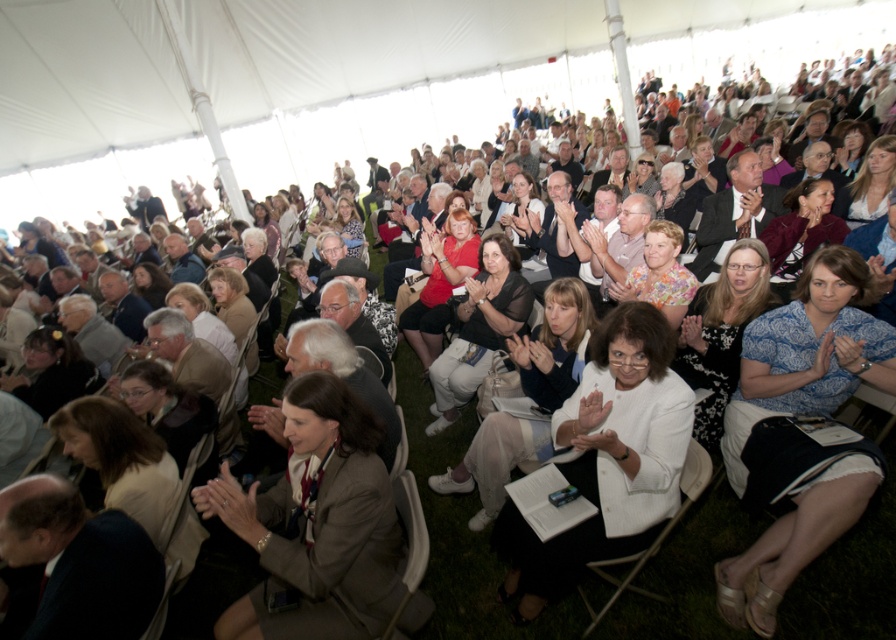
Question: Is floral fabric dress at center to the left of light brown leather jacket at center from the viewer's perspective?

Choices:
 (A) yes
 (B) no

Answer: (B)

Question: Does matte red shirt at center have a smaller size compared to floral fabric dress at center?

Choices:
 (A) no
 (B) yes

Answer: (A)

Question: Observing the image, what is the correct spatial positioning of light brown hair at lower center in reference to matte red shirt at center?

Choices:
 (A) left
 (B) right

Answer: (A)

Question: Estimate the real-world distances between objects in this image. Which object is farther from the light brown hair at lower center?

Choices:
 (A) black lace dress at center
 (B) white fabric dress at center
 (C) matte brown jacket at center
 (D) white fabric jacket at center

Answer: (C)

Question: Which object appears closest to the camera in this image?

Choices:
 (A) light brown hair at lower center
 (B) brown fabric jacket at lower left
 (C) blue printed blouse at center
 (D) black lace dress at center

Answer: (B)

Question: Which object is farther from the camera taking this photo?

Choices:
 (A) black lace dress at center
 (B) matte red shirt at center
 (C) light brown leather jacket at center
 (D) white fabric jacket at center

Answer: (B)